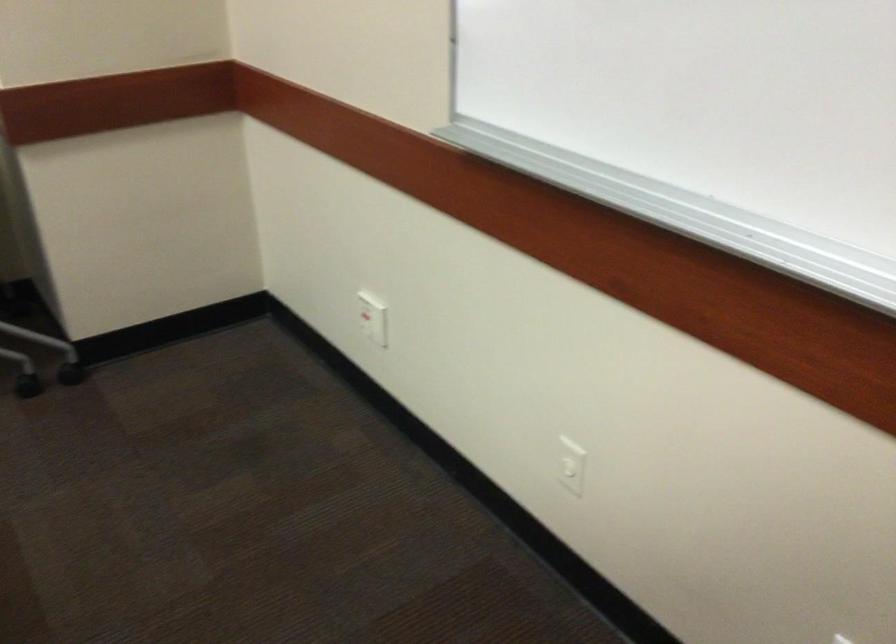
The first image is from the beginning of the video and the second image is from the end. How did the camera likely rotate when shooting the video?

The rotation direction of the camera is right-down.